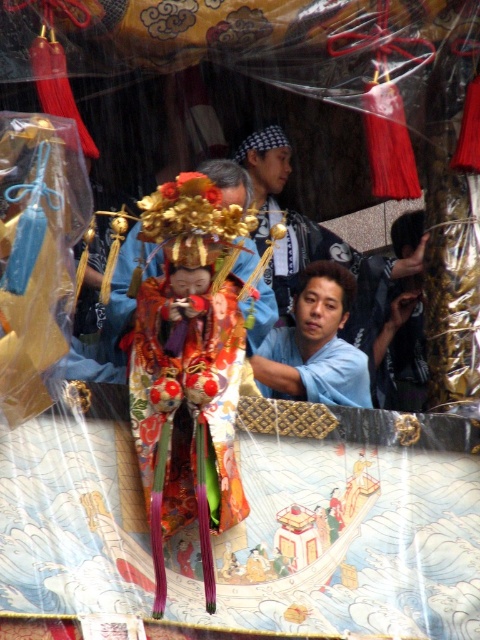
Question: Is blue cotton shirt at center below matte blue shirt at center?

Choices:
 (A) yes
 (B) no

Answer: (B)

Question: Observing the image, what is the correct spatial positioning of blue cotton shirt at center in reference to matte blue shirt at center?

Choices:
 (A) below
 (B) above

Answer: (B)

Question: Among these points, which one is farthest from the camera?

Choices:
 (A) (323, 314)
 (B) (336, 241)

Answer: (B)

Question: Is blue cotton shirt at center smaller than matte blue shirt at center?

Choices:
 (A) no
 (B) yes

Answer: (A)

Question: Which point is farther from the camera taking this photo?

Choices:
 (A) (422, 253)
 (B) (344, 298)

Answer: (A)